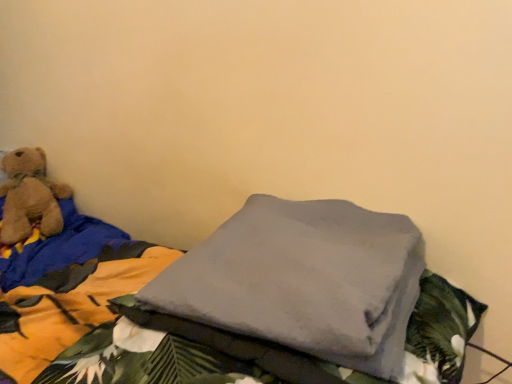
Measure the distance between point (24, 159) and camera.

The depth of point (24, 159) is 5.96 feet.

Locate an element on the screen. Image resolution: width=512 pixels, height=384 pixels. soft brown teddy bear at left is located at coordinates (30, 197).

The height and width of the screenshot is (384, 512). What do you see at coordinates (30, 197) in the screenshot?
I see `soft brown teddy bear at left` at bounding box center [30, 197].

The height and width of the screenshot is (384, 512). Describe the element at coordinates (123, 321) in the screenshot. I see `gray fleece blanket at center` at that location.

At what (x,y) coordinates should I click in order to perform the action: click on gray fleece blanket at center. Please return your answer as a coordinate pair (x, y). Image resolution: width=512 pixels, height=384 pixels. Looking at the image, I should click on (123, 321).

Locate an element on the screen. This screenshot has height=384, width=512. soft brown teddy bear at left is located at coordinates (30, 197).

Considering the positions of objects gray fleece blanket at center and soft brown teddy bear at left in the image provided, who is more to the left, gray fleece blanket at center or soft brown teddy bear at left?

soft brown teddy bear at left.

From the picture: Is gray fleece blanket at center in front of or behind soft brown teddy bear at left in the image?

gray fleece blanket at center is positioned closer to the viewer than soft brown teddy bear at left.

Which is in front, point (78, 297) or point (19, 217)?

The point (78, 297) is closer.

Looking at this image, from the image's perspective, which one is positioned lower, gray fleece blanket at center or soft brown teddy bear at left?

gray fleece blanket at center appears lower in the image.

From a real-world perspective, is gray fleece blanket at center positioned under soft brown teddy bear at left based on gravity?

Yes, from a real-world perspective, gray fleece blanket at center is under soft brown teddy bear at left.

Which object is wider, gray fleece blanket at center or soft brown teddy bear at left?

With larger width is gray fleece blanket at center.

Which of these two, gray fleece blanket at center or soft brown teddy bear at left, stands shorter?

Standing shorter between the two is gray fleece blanket at center.

Can you confirm if gray fleece blanket at center is smaller than soft brown teddy bear at left?

Correct, gray fleece blanket at center occupies less space than soft brown teddy bear at left.

From the picture: Would you say soft brown teddy bear at left is part of gray fleece blanket at center's contents?

No, soft brown teddy bear at left is not surrounded by gray fleece blanket at center.

Is gray fleece blanket at center in contact with soft brown teddy bear at left?

No, gray fleece blanket at center is not beside soft brown teddy bear at left.

Is gray fleece blanket at center looking in the opposite direction of soft brown teddy bear at left?

No, gray fleece blanket at center's orientation is not away from soft brown teddy bear at left.

What's the angular difference between gray fleece blanket at center and soft brown teddy bear at left's facing directions?

There is a 56.7-degree angle between the facing directions of gray fleece blanket at center and soft brown teddy bear at left.

The height and width of the screenshot is (384, 512). Find the location of `bed that appears in front of the soft brown teddy bear at left`. bed that appears in front of the soft brown teddy bear at left is located at coordinates (123, 321).

Which is more to the right, soft brown teddy bear at left or gray fleece blanket at center?

gray fleece blanket at center is more to the right.

In the scene shown: In the image, is soft brown teddy bear at left positioned in front of or behind gray fleece blanket at center?

soft brown teddy bear at left is positioned farther from the viewer than gray fleece blanket at center.

Is point (0, 239) closer to camera compared to point (445, 313)?

No, it is not.

From the image's perspective, between soft brown teddy bear at left and gray fleece blanket at center, who is located below?

gray fleece blanket at center is shown below in the image.

From a real-world perspective, is soft brown teddy bear at left beneath gray fleece blanket at center?

No.

Between soft brown teddy bear at left and gray fleece blanket at center, which one has smaller width?

soft brown teddy bear at left is thinner.

Considering the relative sizes of soft brown teddy bear at left and gray fleece blanket at center in the image provided, is soft brown teddy bear at left taller than gray fleece blanket at center?

Indeed, soft brown teddy bear at left has a greater height compared to gray fleece blanket at center.

In terms of size, does soft brown teddy bear at left appear bigger or smaller than gray fleece blanket at center?

Clearly, soft brown teddy bear at left is larger in size than gray fleece blanket at center.

Could gray fleece blanket at center be considered to be inside soft brown teddy bear at left?

No, gray fleece blanket at center is not a part of soft brown teddy bear at left.

Looking at this image, is there a large distance between soft brown teddy bear at left and gray fleece blanket at center?

No, there isn't a large distance between soft brown teddy bear at left and gray fleece blanket at center.

In the scene shown: Could you tell me if soft brown teddy bear at left is turned towards gray fleece blanket at center?

No, soft brown teddy bear at left is not oriented towards gray fleece blanket at center.

How many degrees apart are the facing directions of soft brown teddy bear at left and gray fleece blanket at center?

soft brown teddy bear at left and gray fleece blanket at center are facing 56.7 degrees away from each other.

How distant is soft brown teddy bear at left from gray fleece blanket at center?

soft brown teddy bear at left is 15.20 inches away from gray fleece blanket at center.

Identify the location of bed in front of the soft brown teddy bear at left. (123, 321).

Identify the location of teddy bear above the gray fleece blanket at center (from the image's perspective). (30, 197).

This screenshot has width=512, height=384. I want to click on bed in front of the soft brown teddy bear at left, so click(x=123, y=321).